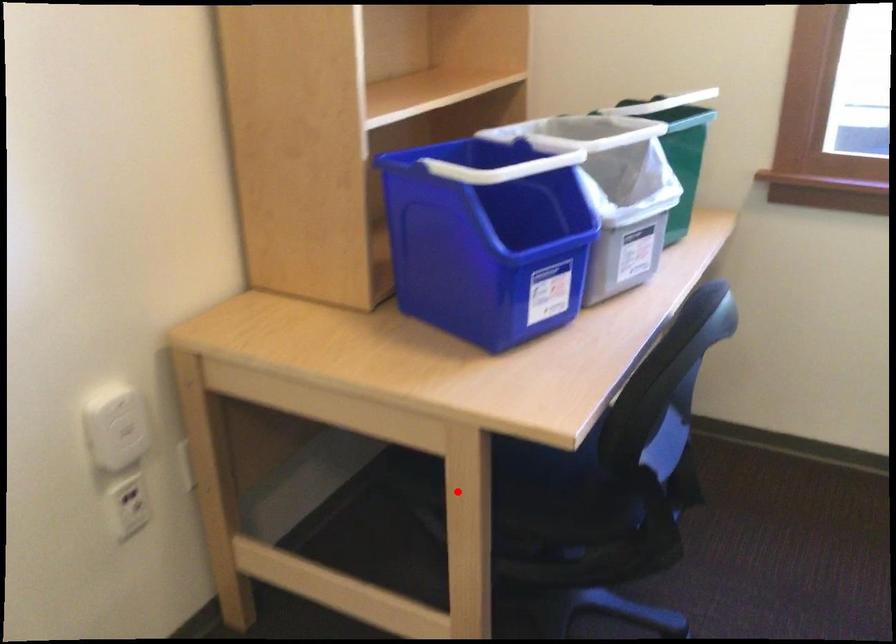
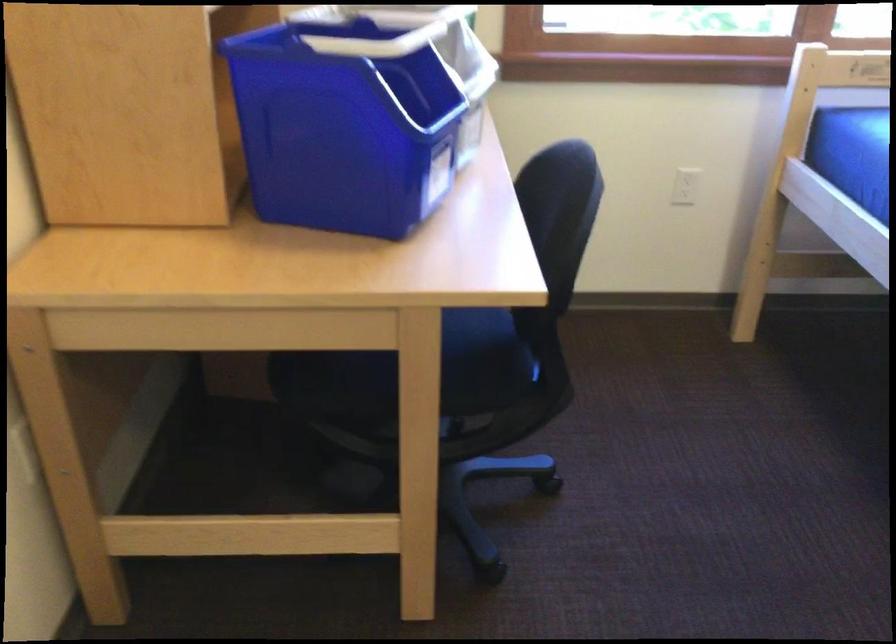
The point at the highlighted location is marked in the first image. Where is the corresponding point in the second image?

(409, 384)